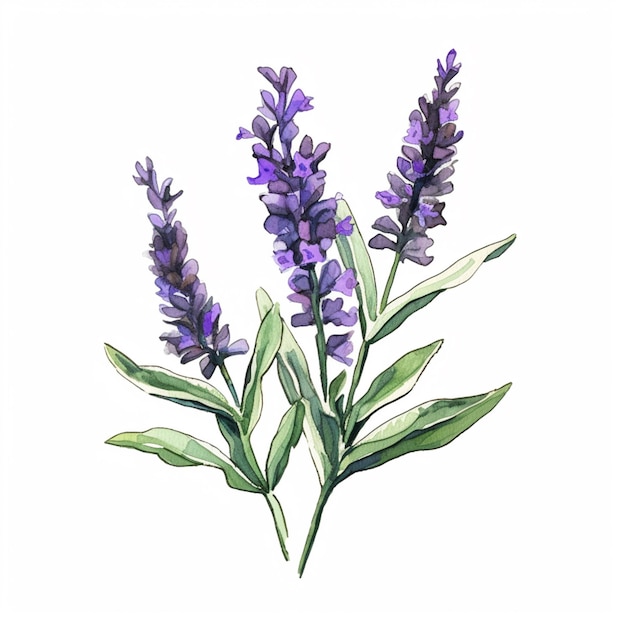
Find the location of a particular element. right plant is located at coordinates (362, 357).